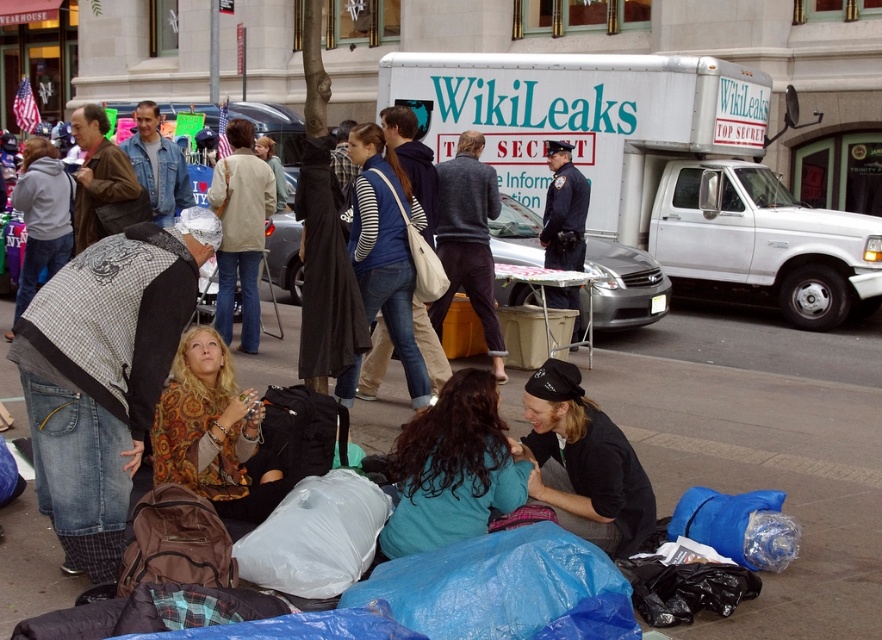
Measure the distance from blue tarp at lower center to light beige jacket at center.

blue tarp at lower center is 2.69 meters away from light beige jacket at center.

Does blue tarp at lower center appear on the left side of light beige jacket at center?

Incorrect, blue tarp at lower center is not on the left side of light beige jacket at center.

Does point (854, 392) come closer to viewer compared to point (258, 257)?

Yes, it is.

You are a GUI agent. You are given a task and a screenshot of the screen. Output one action in this format:
    pyautogui.click(x=<x>, y=<y>)
    Task: Click on the blue tarp at lower center
    
    Given the screenshot: What is the action you would take?
    pyautogui.click(x=763, y=451)

Is teal fabric jacket at center to the left of light beige jacket at center from the viewer's perspective?

In fact, teal fabric jacket at center is to the right of light beige jacket at center.

Which is above, teal fabric jacket at center or light beige jacket at center?

light beige jacket at center is higher up.

Who is more forward, (451,420) or (262,173)?

Point (451,420) is more forward.

Where is `teal fabric jacket at center`? This screenshot has width=882, height=640. teal fabric jacket at center is located at coordinates (452, 468).

Can you confirm if blue tarp at lower center is shorter than dark brown leather jacket at lower center?

No.

Can you confirm if blue tarp at lower center is thinner than dark brown leather jacket at lower center?

Incorrect, blue tarp at lower center's width is not less than dark brown leather jacket at lower center's.

Measure the distance between point (781, 620) and camera.

Point (781, 620) is 4.31 meters from camera.

Find the location of a particular element. This screenshot has height=640, width=882. blue tarp at lower center is located at coordinates (763, 451).